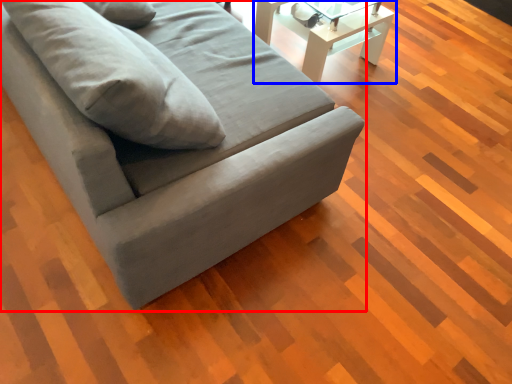
Question: Which of the following is the farthest to the observer, studio couch (highlighted by a red box) or table (highlighted by a blue box)?

Choices:
 (A) studio couch
 (B) table

Answer: (B)